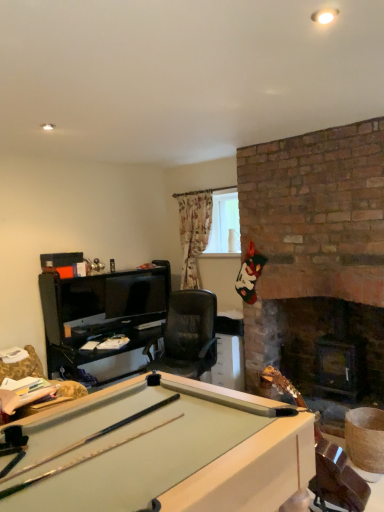
Question: From the image's perspective, is clear glass window at upper center located above black leather swivel chair at lower left?

Choices:
 (A) yes
 (B) no

Answer: (A)

Question: Would you say black leather swivel chair at lower left is part of clear glass window at upper center's contents?

Choices:
 (A) no
 (B) yes

Answer: (A)

Question: Is clear glass window at upper center positioned with its back to black leather swivel chair at lower left?

Choices:
 (A) no
 (B) yes

Answer: (A)

Question: Is clear glass window at upper center at the left side of black leather swivel chair at lower left?

Choices:
 (A) no
 (B) yes

Answer: (A)

Question: Is clear glass window at upper center located outside black leather swivel chair at lower left?

Choices:
 (A) yes
 (B) no

Answer: (A)

Question: Considering their positions, is clear glass window at upper center located in front of or behind wooden cue stick at lower right?

Choices:
 (A) behind
 (B) front

Answer: (A)

Question: Looking at the image, does clear glass window at upper center seem bigger or smaller compared to wooden cue stick at lower right?

Choices:
 (A) big
 (B) small

Answer: (B)

Question: From the image's perspective, is clear glass window at upper center located above or below wooden cue stick at lower right?

Choices:
 (A) above
 (B) below

Answer: (A)

Question: Which is correct: clear glass window at upper center is inside wooden cue stick at lower right, or outside of it?

Choices:
 (A) outside
 (B) inside

Answer: (A)

Question: Is point (269, 370) positioned closer to the camera than point (14, 375)?

Choices:
 (A) farther
 (B) closer

Answer: (B)

Question: From a real-world perspective, is wooden cue stick at lower right physically located above or below black leather swivel chair at lower left?

Choices:
 (A) below
 (B) above

Answer: (A)

Question: From the image's perspective, relative to black leather swivel chair at lower left, is wooden cue stick at lower right above or below?

Choices:
 (A) below
 (B) above

Answer: (A)

Question: Is wooden cue stick at lower right inside or outside of black leather swivel chair at lower left?

Choices:
 (A) outside
 (B) inside

Answer: (A)

Question: Is point (19, 369) closer or farther from the camera than point (210, 245)?

Choices:
 (A) closer
 (B) farther

Answer: (A)

Question: Is black leather swivel chair at lower left wider or thinner than clear glass window at upper center?

Choices:
 (A) wide
 (B) thin

Answer: (A)